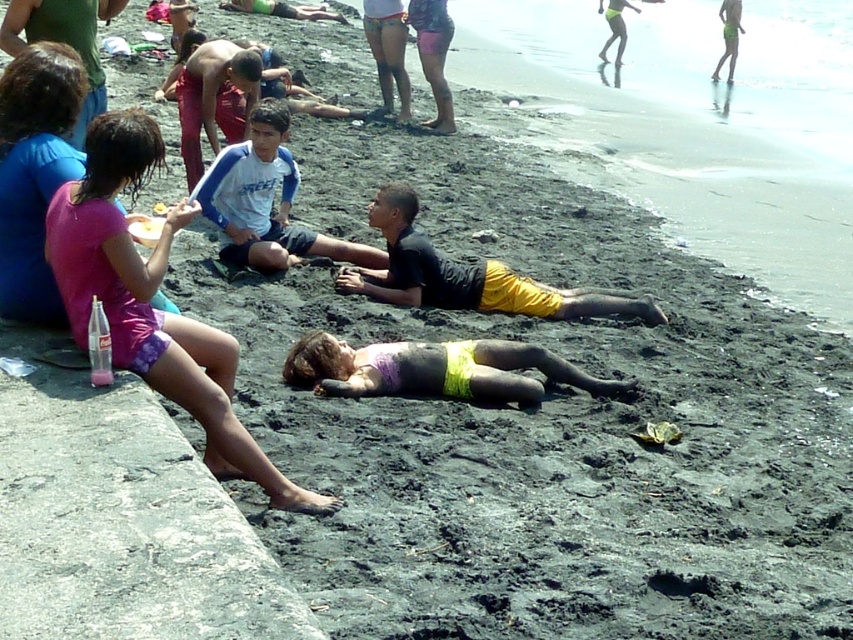
You are a photographer trying to capture a candid shot of both the matte purple bikini top at center and the white cotton shirt at center. Since you want to ensure both are fully visible in the frame, which clothing item should you focus on first to adjust your camera angle?

The matte purple bikini top at center is shorter than the white cotton shirt at center, so you should focus on adjusting your camera angle to ensure the shorter matte purple bikini top at center is fully visible first.

You are standing at the camera position and want to toss a beach ball to the person wearing the purple fabric shorts at lower left. The ball travels in a straight line. Is the distance less than 5 meters?

The distance between the purple fabric shorts at lower left and the camera is 4.90 meters, which is less than 5 meters. Yes, the ball can be tossed within that distance.

You are a photographer trying to capture a photo of the matte purple bikini top at center without the purple fabric shorts at lower left blocking the view. Is this possible based on their positions?

The purple fabric shorts at lower left is in front of matte purple bikini top at center, so it would block the view. Move to a position where the purple fabric shorts at lower left is not between you and the matte purple bikini top at center.